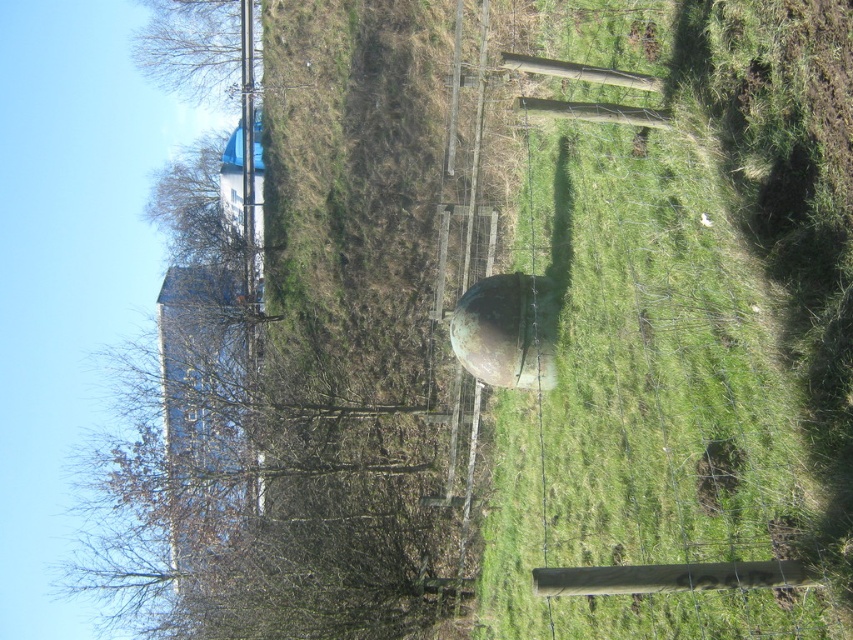
Question: Can you confirm if green grassy field at center is positioned to the left of green matte water tower at center?

Choices:
 (A) yes
 (B) no

Answer: (B)

Question: Which of the following is the closest to the observer?

Choices:
 (A) green grassy field at center
 (B) green matte water tower at center

Answer: (A)

Question: Which object is closer to the camera taking this photo?

Choices:
 (A) green matte water tower at center
 (B) green grassy field at center

Answer: (B)

Question: Can you confirm if green grassy field at center is thinner than green matte water tower at center?

Choices:
 (A) yes
 (B) no

Answer: (B)

Question: Is green grassy field at center thinner than green matte water tower at center?

Choices:
 (A) yes
 (B) no

Answer: (B)